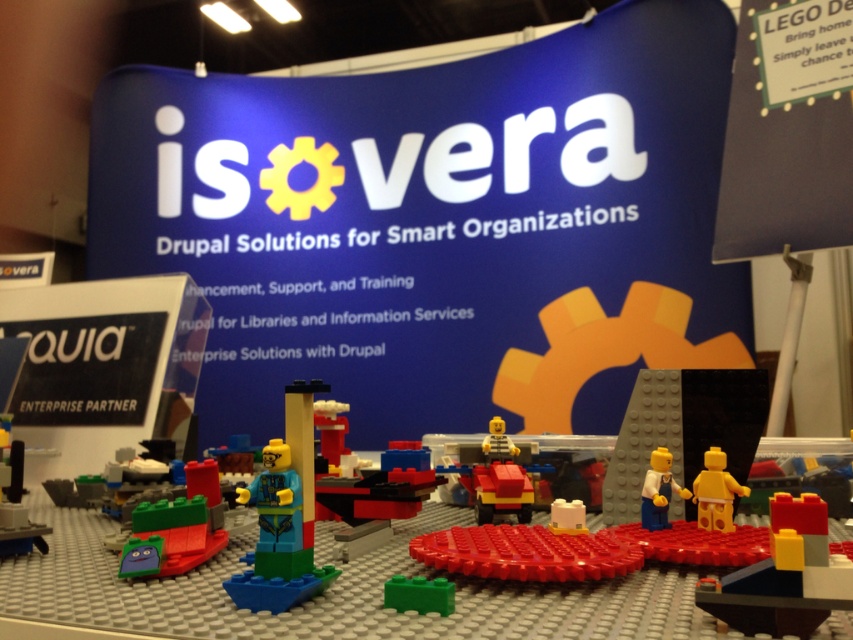
Which is above, blue plastic minifigure at center or bright yellow plastic minifigure at center?

bright yellow plastic minifigure at center

Between blue plastic minifigure at center and bright yellow plastic minifigure at center, which one appears on the left side from the viewer's perspective?

blue plastic minifigure at center

Between point (293, 476) and point (485, 444), which one is positioned in front?

Positioned in front is point (293, 476).

The width and height of the screenshot is (853, 640). I want to click on blue plastic minifigure at center, so click(x=277, y=540).

Between brick red plastic toy at center and bright yellow plastic minifigure at center, which one is positioned lower?

Positioned lower is brick red plastic toy at center.

Between point (747, 604) and point (489, 420), which one is positioned in front?

Point (747, 604) is more forward.

Between point (811, 630) and point (492, 442), which one is positioned in front?

Point (811, 630) is more forward.

Find the location of a particular element. brick red plastic toy at center is located at coordinates (785, 577).

Which is more to the left, blue plastic minifigure at center or green plastic brick at center?

→ Positioned to the left is blue plastic minifigure at center.

Is blue plastic minifigure at center further to the viewer compared to green plastic brick at center?

That is True.

Is point (288, 544) closer to viewer compared to point (387, 602)?

No.

Image resolution: width=853 pixels, height=640 pixels. I want to click on blue plastic minifigure at center, so click(277, 540).